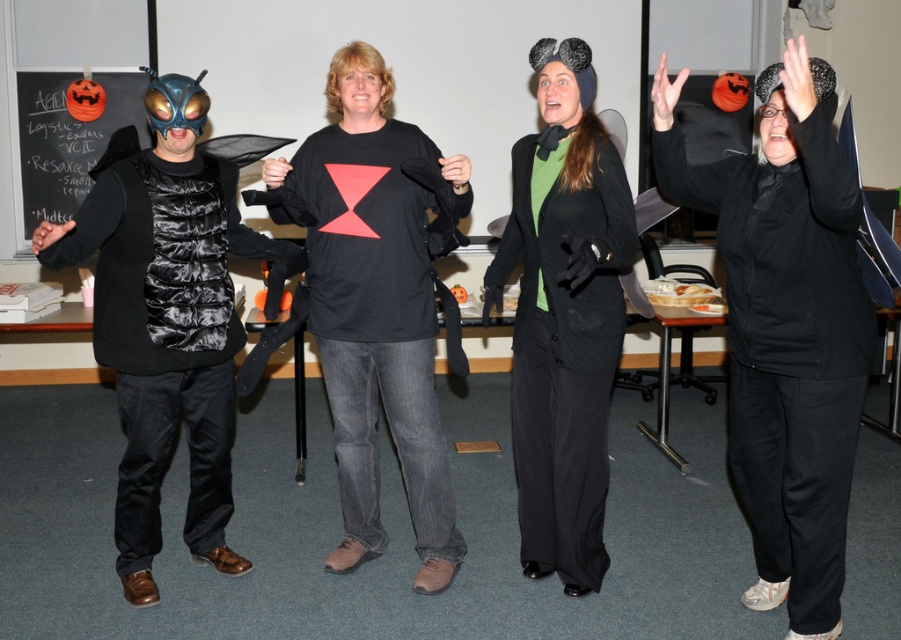
Question: Which of the following is the closest to the observer?

Choices:
 (A) (399, 296)
 (B) (217, 340)

Answer: (B)

Question: Which object is farther from the camera taking this photo?

Choices:
 (A) matte black coat at center
 (B) black matte t-shirt at center
 (C) black matte pants at right
 (D) black chalkboard at upper left

Answer: (D)

Question: Does shiny black vest at left appear over black matte t-shirt at center?

Choices:
 (A) yes
 (B) no

Answer: (B)

Question: Is shiny black vest at left thinner than matte black coat at center?

Choices:
 (A) no
 (B) yes

Answer: (A)

Question: Which point is farther to the camera?

Choices:
 (A) (446, 518)
 (B) (49, 179)
 (C) (616, 292)

Answer: (B)

Question: Does black matte pants at right have a larger size compared to black matte t-shirt at center?

Choices:
 (A) no
 (B) yes

Answer: (B)